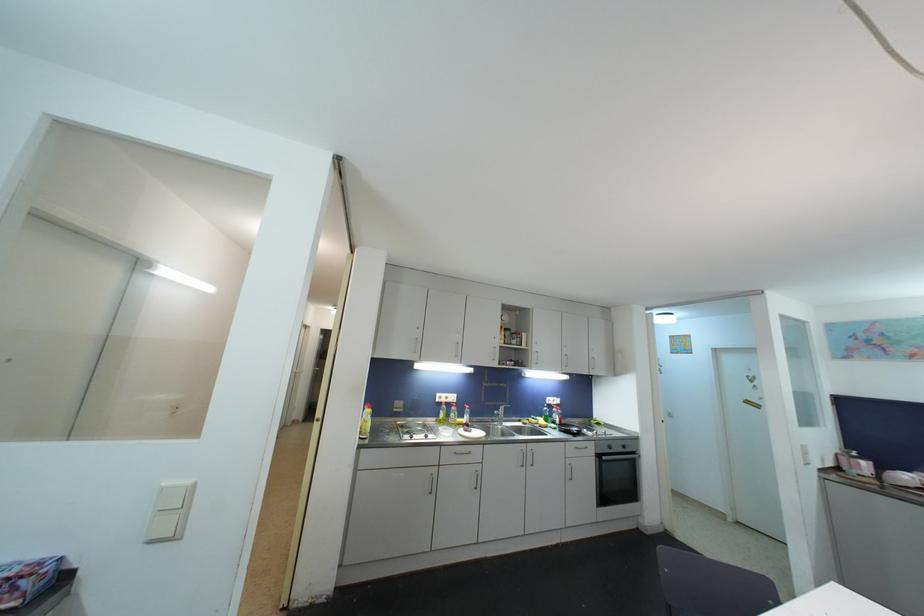
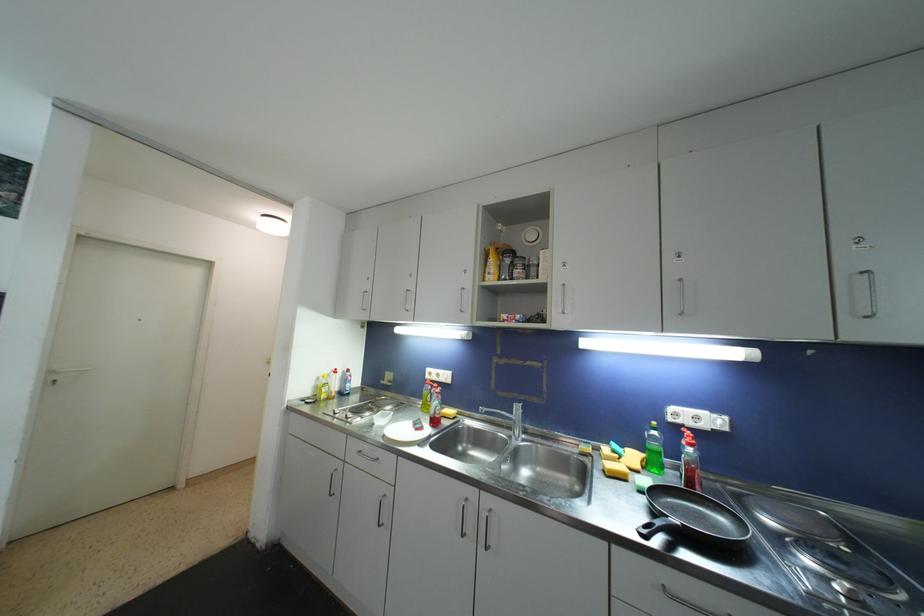
In the second image, find the point that corresponds to the point at 558,406 in the first image.

(708, 429)